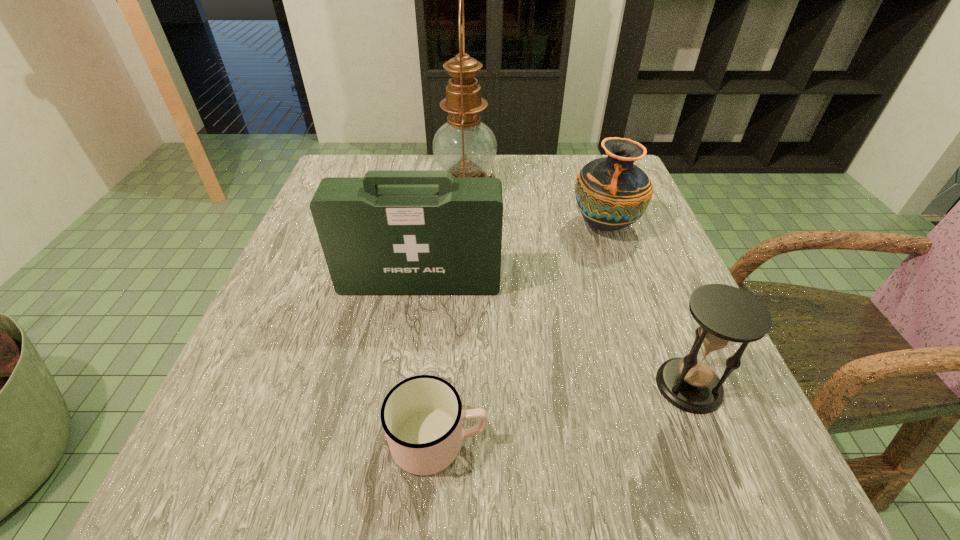
Image resolution: width=960 pixels, height=540 pixels. What are the coordinates of `free space located 0.240m on the side of the mug with the handle` in the screenshot? It's located at (664, 441).

This screenshot has width=960, height=540. I want to click on oil lamp at the far edge, so click(x=466, y=147).

Locate an element on the screen. pottery that is at the far edge is located at coordinates (612, 193).

Locate an element on the screen. This screenshot has width=960, height=540. object present at the near edge is located at coordinates (422, 416).

Locate an element on the screen. This screenshot has width=960, height=540. object that is positioned at the left edge is located at coordinates (392, 232).

Where is `pottery located in the right edge section of the desktop`? This screenshot has height=540, width=960. pottery located in the right edge section of the desktop is located at coordinates (612, 193).

At what (x,y) coordinates should I click in order to perform the action: click on hourglass located in the right edge section of the desktop. Please return your answer as a coordinate pair (x, y). Looking at the image, I should click on (726, 315).

Locate an element on the screen. object that is at the far right corner is located at coordinates (612, 193).

This screenshot has height=540, width=960. Identify the location of free space at the far edge of the desktop. (516, 165).

Locate an element on the screen. The width and height of the screenshot is (960, 540). free region at the near edge is located at coordinates coord(465,501).